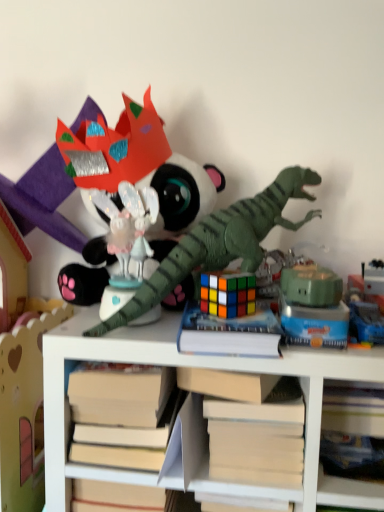
The height and width of the screenshot is (512, 384). What do you see at coordinates (229, 334) in the screenshot?
I see `hardcover book at center` at bounding box center [229, 334].

Measure the distance between hardcover book at center and camera.

hardcover book at center and camera are 20.57 inches apart from each other.

You are a GUI agent. You are given a task and a screenshot of the screen. Output one action in this format:
    pyautogui.click(x=<x>, y=<y>)
    Task: Click on the green matte dinosaur at center, which is the fifth toy in left-to-right order
    The image size is (384, 512).
    Given the screenshot: What is the action you would take?
    point(313,306)

The width and height of the screenshot is (384, 512). In order to click on rubik's cube at center, the 2th toy viewed from the left in this screenshot , I will do `click(228, 294)`.

The width and height of the screenshot is (384, 512). What do you see at coordinates (220, 242) in the screenshot?
I see `green matte dinosaur at center, marked as the 4th toy in a right-to-left arrangement` at bounding box center [220, 242].

At what (x,y) coordinates should I click in order to perform the action: click on green matte dinosaur at center, the third toy in the left-to-right sequence. Please return your answer as a coordinate pair (x, y). Looking at the image, I should click on (220, 242).

Based on the photo, what is the approximate width of green matte robot at center, arranged as the 3th toy when viewed from the right?

green matte robot at center, arranged as the 3th toy when viewed from the right, is 3.28 inches wide.

Consider the image. Measure the distance between point (190, 193) and camera.

A distance of 30.91 inches exists between point (190, 193) and camera.

Identify the location of hardcover book at center. (229, 334).

Considering the points (294, 285) and (304, 296), which point is in front, point (294, 285) or point (304, 296)?

Point (304, 296)

Is green matte robot at center, which ranks as the fourth toy in left-to-right order, turned away from green matte dinosaur at center, which is the second toy in right-to-left order?

No, green matte robot at center, which ranks as the fourth toy in left-to-right order, is not facing the opposite direction of green matte dinosaur at center, which is the second toy in right-to-left order.

From a real-world perspective, who is located lower, green matte robot at center, which ranks as the fourth toy in left-to-right order, or green matte dinosaur at center, which is the second toy in right-to-left order?

In real-world perspective, green matte dinosaur at center, which is the second toy in right-to-left order, is lower.

Does green matte robot at center, arranged as the 3th toy when viewed from the right, have a larger size compared to green matte dinosaur at center, which is the second toy in right-to-left order?

No.

Which is in front, white matte book at center or green matte dinosaur at center, the third toy in the left-to-right sequence?

Positioned in front is green matte dinosaur at center, the third toy in the left-to-right sequence.

Is white matte book at center facing away from green matte dinosaur at center, the third toy in the left-to-right sequence?

No.

From the picture: Can you confirm if white matte book at center is smaller than green matte dinosaur at center, marked as the 4th toy in a right-to-left arrangement?

Correct, white matte book at center occupies less space than green matte dinosaur at center, marked as the 4th toy in a right-to-left arrangement.

Who is bigger, green matte dinosaur at center, marked as the 4th toy in a right-to-left arrangement, or shiny plastic dragon at center, which is the sixth toy in right-to-left order?

green matte dinosaur at center, marked as the 4th toy in a right-to-left arrangement.

Which object is closer to the camera taking this photo, green matte dinosaur at center, marked as the 4th toy in a right-to-left arrangement, or shiny plastic dragon at center, placed as the 1th toy when sorted from left to right?

Positioned in front is green matte dinosaur at center, marked as the 4th toy in a right-to-left arrangement.

Is point (133, 296) positioned in front of point (204, 199)?

Yes, point (133, 296) is in front of point (204, 199).

Considering the relative sizes of green matte dinosaur at center, marked as the 4th toy in a right-to-left arrangement, and shiny plastic dragon at center, which is the sixth toy in right-to-left order, in the image provided, is green matte dinosaur at center, marked as the 4th toy in a right-to-left arrangement, taller than shiny plastic dragon at center, which is the sixth toy in right-to-left order,?

Incorrect, the height of green matte dinosaur at center, marked as the 4th toy in a right-to-left arrangement, is not larger of that of shiny plastic dragon at center, which is the sixth toy in right-to-left order.

Is white matte book at center further to the viewer compared to green matte robot at center, arranged as the 3th toy when viewed from the right?

No, the depth of white matte book at center is less than that of green matte robot at center, arranged as the 3th toy when viewed from the right.

Is green matte robot at center, arranged as the 3th toy when viewed from the right, at the back of white matte book at center?

That's not correct — white matte book at center is not looking away from green matte robot at center, arranged as the 3th toy when viewed from the right.

Is white matte book at center not inside green matte robot at center, which ranks as the fourth toy in left-to-right order?

Yes, white matte book at center is outside of green matte robot at center, which ranks as the fourth toy in left-to-right order.

How much distance is there between white matte book at center and green matte robot at center, arranged as the 3th toy when viewed from the right?

white matte book at center is 27.09 centimeters away from green matte robot at center, arranged as the 3th toy when viewed from the right.

Is green matte dinosaur at center, which is the fifth toy in left-to-right order, shorter than hardcover book at center?

Incorrect, the height of green matte dinosaur at center, which is the fifth toy in left-to-right order, does not fall short of that of hardcover book at center.

Does green matte dinosaur at center, which is the second toy in right-to-left order, have a lesser width compared to hardcover book at center?

Yes, green matte dinosaur at center, which is the second toy in right-to-left order, is thinner than hardcover book at center.

Considering the positions of objects green matte dinosaur at center, which is the second toy in right-to-left order, and hardcover book at center in the image provided, who is more to the left, green matte dinosaur at center, which is the second toy in right-to-left order, or hardcover book at center?

hardcover book at center.

Is green matte dinosaur at center, which is the fifth toy in left-to-right order, completely or partially outside of hardcover book at center?

Yes, green matte dinosaur at center, which is the fifth toy in left-to-right order, is not within hardcover book at center.

Which is correct: hardcover book at center is inside metallic silver toy at center, which appears as the sixth toy when viewed from the left, or outside of it?

hardcover book at center exists outside the volume of metallic silver toy at center, which appears as the sixth toy when viewed from the left.

Are hardcover book at center and metallic silver toy at center, arranged as the first toy when viewed from the right, making contact?

No, hardcover book at center is not touching metallic silver toy at center, arranged as the first toy when viewed from the right.

Which is behind, hardcover book at center or metallic silver toy at center, which appears as the sixth toy when viewed from the left?

metallic silver toy at center, which appears as the sixth toy when viewed from the left, is further away from the camera.

Which of these two, hardcover book at center or metallic silver toy at center, arranged as the first toy when viewed from the right, is bigger?

With larger size is hardcover book at center.

Is point (319, 281) farther from viewer compared to point (197, 256)?

No.

Is green matte dinosaur at center, which is the fifth toy in left-to-right order, behind green matte dinosaur at center, marked as the 4th toy in a right-to-left arrangement?

→ Yes, green matte dinosaur at center, which is the fifth toy in left-to-right order, is behind green matte dinosaur at center, marked as the 4th toy in a right-to-left arrangement.

Can you confirm if green matte dinosaur at center, which is the second toy in right-to-left order, is wider than green matte dinosaur at center, marked as the 4th toy in a right-to-left arrangement?

In fact, green matte dinosaur at center, which is the second toy in right-to-left order, might be narrower than green matte dinosaur at center, marked as the 4th toy in a right-to-left arrangement.

In the scene shown: Between green matte dinosaur at center, which is the fifth toy in left-to-right order, and green matte dinosaur at center, the third toy in the left-to-right sequence, which one has less height?

Standing shorter between the two is green matte dinosaur at center, which is the fifth toy in left-to-right order.

From a real-world perspective, count 2nd toys downward from the green matte robot at center, which ranks as the fourth toy in left-to-right order, and point to it. Please provide its 2D coordinates.

[(313, 306)]

Where is `toy located in front of the white matte book at center`? toy located in front of the white matte book at center is located at coordinates (220, 242).

Considering their positions, is hardcover book at center positioned closer to white matte book at center than green matte dinosaur at center, marked as the 4th toy in a right-to-left arrangement?

The object closer to white matte book at center is hardcover book at center.

Based on their spatial positions, is metallic silver toy at center, arranged as the first toy when viewed from the right, or green matte dinosaur at center, the third toy in the left-to-right sequence, further from green matte robot at center, arranged as the 3th toy when viewed from the right?

green matte dinosaur at center, the third toy in the left-to-right sequence, is further to green matte robot at center, arranged as the 3th toy when viewed from the right.

Based on their spatial positions, is white matte book at center or shiny plastic dragon at center, placed as the 1th toy when sorted from left to right, further from green matte robot at center, which ranks as the fourth toy in left-to-right order?

shiny plastic dragon at center, placed as the 1th toy when sorted from left to right, is further to green matte robot at center, which ranks as the fourth toy in left-to-right order.

In the scene shown: Based on their spatial positions, is green matte dinosaur at center, which is the fifth toy in left-to-right order, or green matte dinosaur at center, the third toy in the left-to-right sequence, further from metallic silver toy at center, arranged as the first toy when viewed from the right?

Based on the image, green matte dinosaur at center, the third toy in the left-to-right sequence, appears to be further to metallic silver toy at center, arranged as the first toy when viewed from the right.

Looking at the image, which one is located further to metallic silver toy at center, which appears as the sixth toy when viewed from the left, green matte dinosaur at center, which is the second toy in right-to-left order, or rubik's cube at center, the 2th toy viewed from the left?

Based on the image, rubik's cube at center, the 2th toy viewed from the left, appears to be further to metallic silver toy at center, which appears as the sixth toy when viewed from the left.

Which object lies further to the anchor point hardcover book at center, white matte book at center or green matte dinosaur at center, the third toy in the left-to-right sequence?

The object further to hardcover book at center is green matte dinosaur at center, the third toy in the left-to-right sequence.

Looking at this image, which object lies nearer to the anchor point shiny plastic dragon at center, which is the sixth toy in right-to-left order, white matte book at center or green matte dinosaur at center, which is the fifth toy in left-to-right order?

green matte dinosaur at center, which is the fifth toy in left-to-right order, lies closer to shiny plastic dragon at center, which is the sixth toy in right-to-left order, than the other object.

From the image, which object appears to be farther from metallic silver toy at center, which appears as the sixth toy when viewed from the left, green matte dinosaur at center, the third toy in the left-to-right sequence, or rubik's cube at center, which appears as the 5th toy when viewed from the right?

green matte dinosaur at center, the third toy in the left-to-right sequence, is positioned further to the anchor metallic silver toy at center, which appears as the sixth toy when viewed from the left.

Image resolution: width=384 pixels, height=512 pixels. Identify the location of paperback book between white matte book at center and green matte robot at center, arranged as the 3th toy when viewed from the right. (229, 334).

The image size is (384, 512). In order to click on paperback book located between green matte dinosaur at center, the third toy in the left-to-right sequence, and metallic silver toy at center, which appears as the sixth toy when viewed from the left, in the left-right direction in this screenshot , I will do `click(229, 334)`.

Find the location of a particular element. The width and height of the screenshot is (384, 512). paperback book between shiny plastic dragon at center, which is the sixth toy in right-to-left order, and green matte robot at center, arranged as the 3th toy when viewed from the right, from left to right is located at coordinates (229, 334).

This screenshot has width=384, height=512. What are the coordinates of `paperback book between green matte dinosaur at center, marked as the 4th toy in a right-to-left arrangement, and white matte book at center from top to bottom` in the screenshot? It's located at (229, 334).